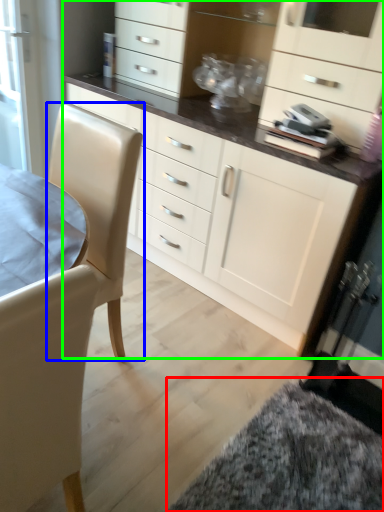
Question: Which object is positioned farthest from wide (highlighted by a red box)? Select from swivel chair (highlighted by a blue box) and cabinetry (highlighted by a green box).

Choices:
 (A) swivel chair
 (B) cabinetry

Answer: (A)